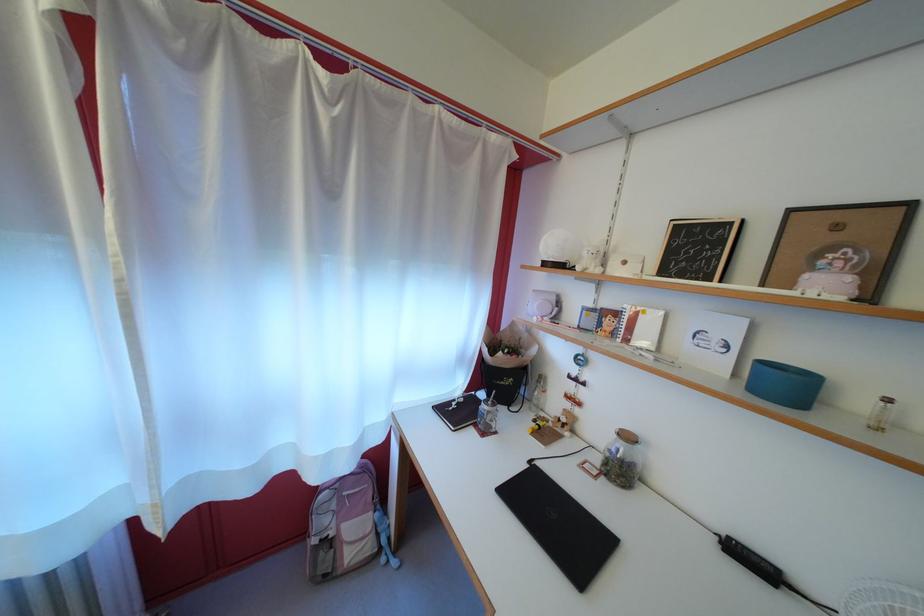
The image size is (924, 616). What are the coordinates of `black power adapter` in the screenshot? It's located at (762, 568).